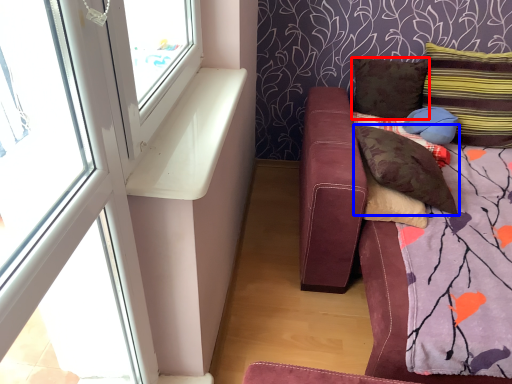
Question: Among these objects, which one is nearest to the camera, pillow (highlighted by a red box) or pillow (highlighted by a blue box)?

Choices:
 (A) pillow
 (B) pillow

Answer: (B)